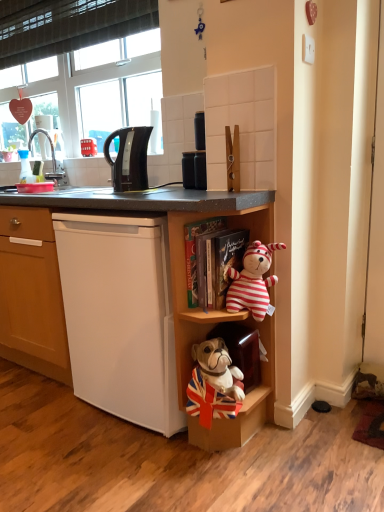
Identify the location of vacant region in front of transparent plastic bottle at left. This screenshot has width=384, height=512. (27, 188).